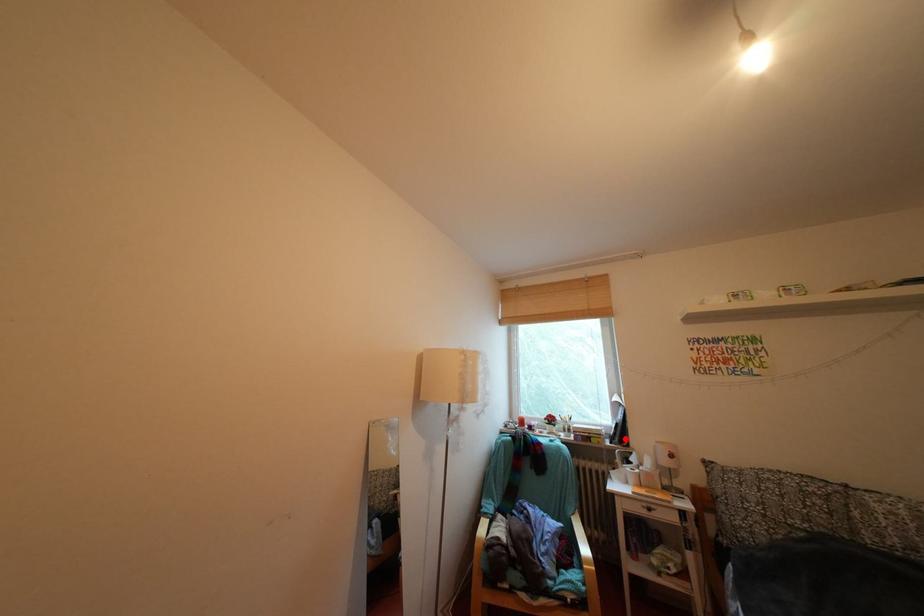
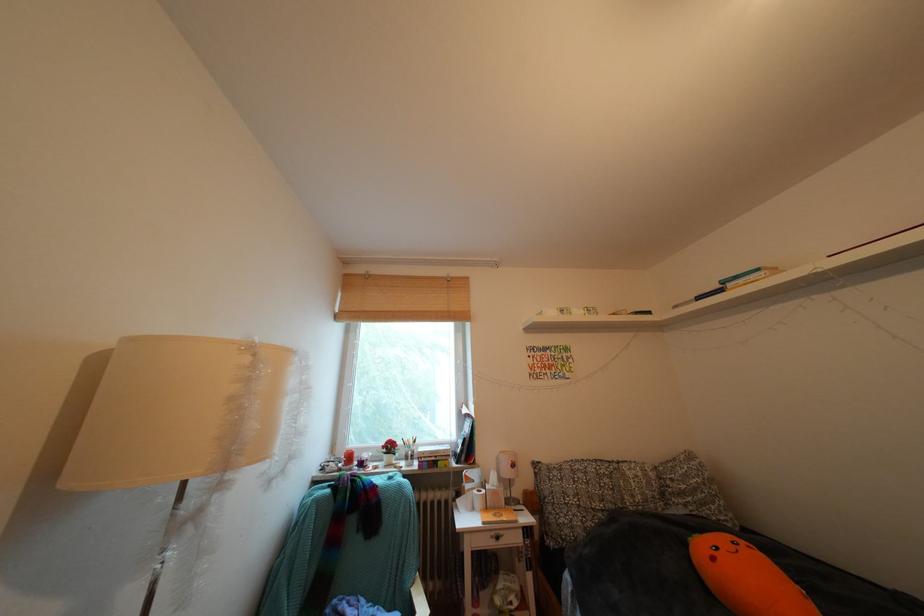
Locate, in the second image, the point that corresponds to the highlighted location in the first image.

(472, 456)